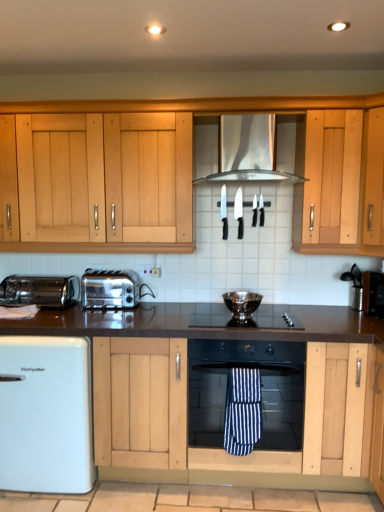
Question: Is black granite countertop at center next to metallic silver toaster at left and touching it?

Choices:
 (A) yes
 (B) no

Answer: (B)

Question: From a real-world perspective, is black granite countertop at center physically below metallic silver toaster at left?

Choices:
 (A) yes
 (B) no

Answer: (A)

Question: Could you tell me if black granite countertop at center is facing metallic silver toaster at left?

Choices:
 (A) yes
 (B) no

Answer: (B)

Question: Is black granite countertop at center looking in the opposite direction of metallic silver toaster at left?

Choices:
 (A) no
 (B) yes

Answer: (A)

Question: Can you confirm if black granite countertop at center is smaller than metallic silver toaster at left?

Choices:
 (A) yes
 (B) no

Answer: (B)

Question: In terms of width, does black glass gas stove at center look wider or thinner when compared to metallic silver toaster at left?

Choices:
 (A) wide
 (B) thin

Answer: (A)

Question: Would you say black glass gas stove at center is to the left or to the right of metallic silver toaster at left in the picture?

Choices:
 (A) right
 (B) left

Answer: (A)

Question: Considering the positions of point (210, 321) and point (14, 281), is point (210, 321) closer or farther from the camera than point (14, 281)?

Choices:
 (A) closer
 (B) farther

Answer: (A)

Question: Looking at the image, does black glass gas stove at center seem bigger or smaller compared to metallic silver toaster at left?

Choices:
 (A) small
 (B) big

Answer: (A)

Question: Is white glossy mini fridge at lower left spatially inside black glass gas stove at center, or outside of it?

Choices:
 (A) outside
 (B) inside

Answer: (A)

Question: From the image's perspective, is white glossy mini fridge at lower left above or below black glass gas stove at center?

Choices:
 (A) below
 (B) above

Answer: (A)

Question: In the image, is white glossy mini fridge at lower left positioned in front of or behind black glass gas stove at center?

Choices:
 (A) front
 (B) behind

Answer: (A)

Question: In the image, is white glossy mini fridge at lower left on the left side or the right side of black glass gas stove at center?

Choices:
 (A) left
 (B) right

Answer: (A)

Question: Is silver metallic vent at center taller or shorter than black glass gas stove at center?

Choices:
 (A) tall
 (B) short

Answer: (A)

Question: Would you say silver metallic vent at center is inside or outside black glass gas stove at center?

Choices:
 (A) inside
 (B) outside

Answer: (B)